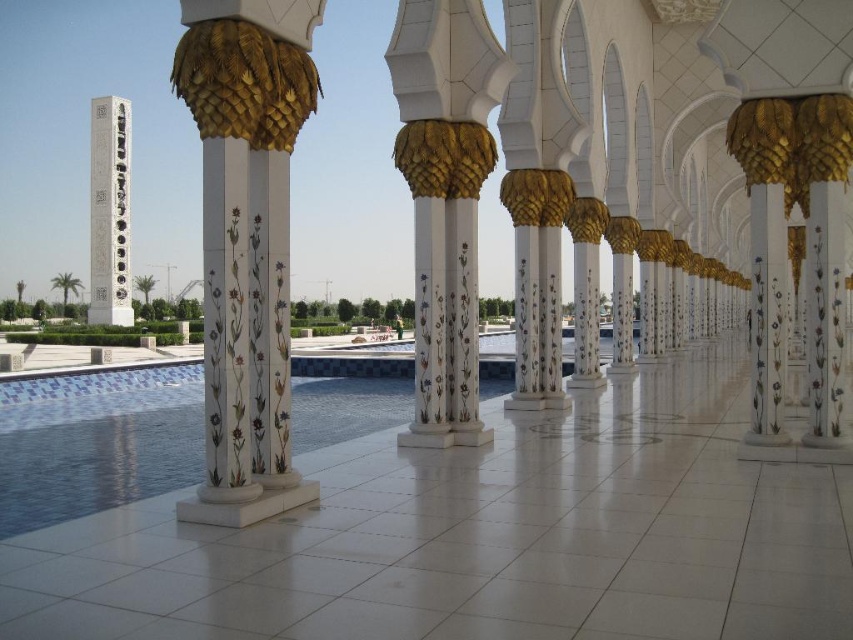
You are standing on the tiled walkway and see the white glossy column at center and the white marble pillar at center. Which one is positioned to the left side of the other?

The white glossy column at center is to the left of white marble pillar at center.

You are an architect designing a garden pathway. You need to place a decorative statue between the white marble pillar at center and the white marble column at left. Which object should the statue be closer to if it must align with the size difference between them?

The statue should be closer to the white marble column at left because it is larger than the white marble pillar at center.